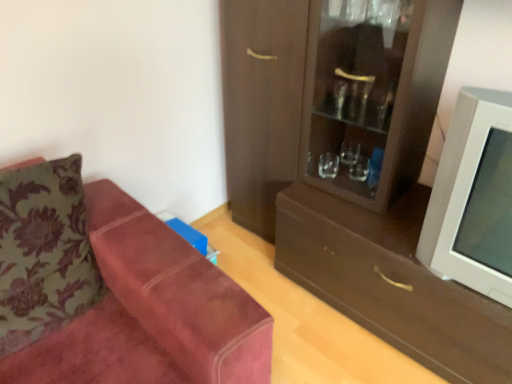
Measure the distance between point (414, 303) and camera.

The distance of point (414, 303) from camera is 4.94 feet.

The height and width of the screenshot is (384, 512). What are the coordinates of `brown matte drawer at center` in the screenshot? It's located at point(391,282).

The image size is (512, 384). What do you see at coordinates (472, 197) in the screenshot?
I see `white plastic television at right` at bounding box center [472, 197].

Find the location of a particular element. Image resolution: width=512 pixels, height=384 pixels. velvet floral pillow at left is located at coordinates (44, 252).

The height and width of the screenshot is (384, 512). Identify the location of matte brown cabinet at right. (330, 98).

Measure the distance from velvet floral pillow at left to suede couch at left.

They are 21.39 centimeters apart.

Is point (83, 300) farther from viewer compared to point (204, 279)?

Yes, point (83, 300) is farther from viewer.

Is velvet floral pillow at left positioned behind suede couch at left?

Yes, the depth of velvet floral pillow at left is greater than that of suede couch at left.

From a real-world perspective, is velvet floral pillow at left positioned under suede couch at left based on gravity?

No, from a real-world perspective, velvet floral pillow at left is not beneath suede couch at left.

Does point (428, 325) lie behind point (23, 220)?

Yes.

Is velvet floral pillow at left inside brown matte drawer at center?

No, velvet floral pillow at left is not inside brown matte drawer at center.

Between brown matte drawer at center and velvet floral pillow at left, which one is positioned behind?

brown matte drawer at center is behind.

Considering the relative sizes of brown matte drawer at center and velvet floral pillow at left in the image provided, is brown matte drawer at center wider than velvet floral pillow at left?

Correct, the width of brown matte drawer at center exceeds that of velvet floral pillow at left.

Considering the relative positions of brown matte drawer at center and suede couch at left in the image provided, is brown matte drawer at center to the right of suede couch at left from the viewer's perspective?

Correct, you'll find brown matte drawer at center to the right of suede couch at left.

Which is less distant, (372, 216) or (151, 254)?

Point (372, 216) is positioned farther from the camera compared to point (151, 254).

Is brown matte drawer at center positioned beyond the bounds of suede couch at left?

Yes.

Looking at this image, from the image's perspective, which one is positioned higher, brown matte drawer at center or suede couch at left?

From the image's view, suede couch at left is above.

Does white plastic television at right lie behind suede couch at left?

Yes, it is.

Is white plastic television at right bigger or smaller than suede couch at left?

Considering their sizes, white plastic television at right takes up less space than suede couch at left.

Who is taller, white plastic television at right or suede couch at left?

Standing taller between the two is suede couch at left.

Is white plastic television at right a part of suede couch at left?

Actually, white plastic television at right is outside suede couch at left.

Locate an element on the screen. The height and width of the screenshot is (384, 512). studio couch directly beneath the white plastic television at right (from a real-world perspective) is located at coordinates (151, 312).

Considering the relative sizes of suede couch at left and white plastic television at right in the image provided, is suede couch at left bigger than white plastic television at right?

Correct, suede couch at left is larger in size than white plastic television at right.

Between suede couch at left and white plastic television at right, which one appears on the right side from the viewer's perspective?

Positioned to the right is white plastic television at right.

Considering the relative sizes of white plastic television at right and brown matte drawer at center in the image provided, is white plastic television at right smaller than brown matte drawer at center?

Actually, white plastic television at right might be larger than brown matte drawer at center.

How many degrees apart are the facing directions of white plastic television at right and brown matte drawer at center?

There is a 91.8-degree angle between the facing directions of white plastic television at right and brown matte drawer at center.

From a real-world perspective, is white plastic television at right physically above brown matte drawer at center?

Yes, from a real-world perspective, white plastic television at right is on top of brown matte drawer at center.

Considering the sizes of white plastic television at right and brown matte drawer at center in the image, is white plastic television at right taller or shorter than brown matte drawer at center?

Clearly, white plastic television at right is taller compared to brown matte drawer at center.

Is suede couch at left in front of matte brown cabinet at right?

Yes, suede couch at left is in front of matte brown cabinet at right.

In the scene shown: Is suede couch at left thinner than matte brown cabinet at right?

Incorrect, the width of suede couch at left is not less than that of matte brown cabinet at right.

From a real-world perspective, is suede couch at left located beneath matte brown cabinet at right?

Yes, from a real-world perspective, suede couch at left is below matte brown cabinet at right.

The image size is (512, 384). Find the location of `pillow that appears on the left of suede couch at left`. pillow that appears on the left of suede couch at left is located at coordinates (44, 252).

This screenshot has height=384, width=512. What are the coordinates of `pillow in front of the brown matte drawer at center` in the screenshot? It's located at (44, 252).

When comparing their distances from suede couch at left, does matte brown cabinet at right or brown matte drawer at center seem closer?

brown matte drawer at center is closer to suede couch at left.

From the image, which object appears to be farther from suede couch at left, matte brown cabinet at right or white plastic television at right?

matte brown cabinet at right is positioned further to the anchor suede couch at left.

Based on their spatial positions, is white plastic television at right or matte brown cabinet at right closer to brown matte drawer at center?

The object closer to brown matte drawer at center is white plastic television at right.

Based on their spatial positions, is velvet floral pillow at left or matte brown cabinet at right closer to white plastic television at right?

matte brown cabinet at right lies closer to white plastic television at right than the other object.

Based on their spatial positions, is velvet floral pillow at left or brown matte drawer at center further from white plastic television at right?

Based on the image, velvet floral pillow at left appears to be further to white plastic television at right.

When comparing their distances from velvet floral pillow at left, does matte brown cabinet at right or white plastic television at right seem further?

white plastic television at right.

Looking at the image, which one is located closer to brown matte drawer at center, matte brown cabinet at right or velvet floral pillow at left?

matte brown cabinet at right lies closer to brown matte drawer at center than the other object.

From the image, which object appears to be farther from matte brown cabinet at right, brown matte drawer at center or velvet floral pillow at left?

The object further to matte brown cabinet at right is velvet floral pillow at left.

You are a GUI agent. You are given a task and a screenshot of the screen. Output one action in this format:
    pyautogui.click(x=<x>, y=<y>)
    Task: Click on the drawer located between velvet floral pillow at left and matte brown cabinet at right in the left-right direction
    Image resolution: width=512 pixels, height=384 pixels.
    Given the screenshot: What is the action you would take?
    pyautogui.click(x=391, y=282)

You are a GUI agent. You are given a task and a screenshot of the screen. Output one action in this format:
    pyautogui.click(x=<x>, y=<y>)
    Task: Click on the drawer between suede couch at left and white plastic television at right from left to right
    This screenshot has height=384, width=512.
    Given the screenshot: What is the action you would take?
    pyautogui.click(x=391, y=282)

Image resolution: width=512 pixels, height=384 pixels. Find the location of `cabinetry situated between suede couch at left and white plastic television at right from left to right`. cabinetry situated between suede couch at left and white plastic television at right from left to right is located at coordinates (330, 98).

I want to click on studio couch situated between velvet floral pillow at left and brown matte drawer at center from left to right, so (x=151, y=312).